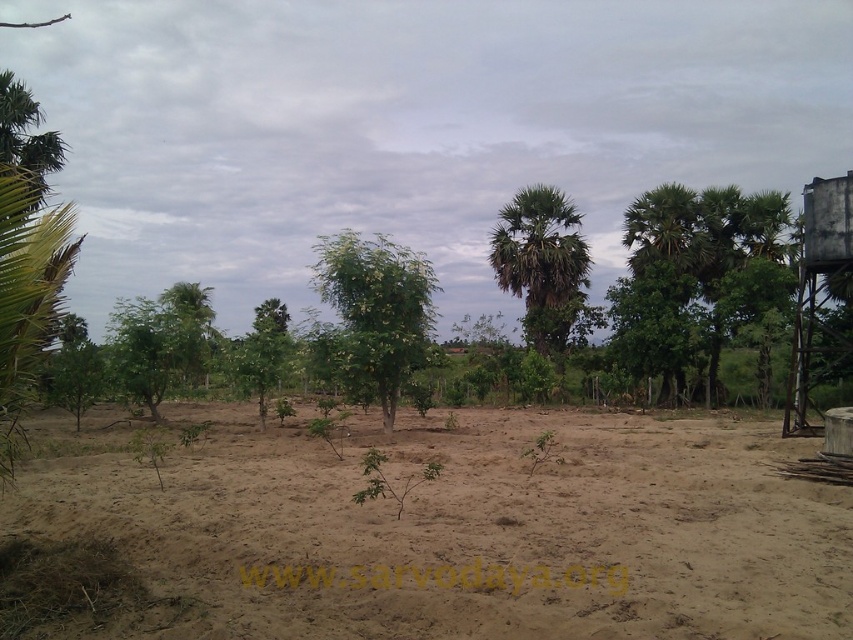
Between brown sandy soil at center and green leafy tree at center, which one is positioned higher?

green leafy tree at center is above.

Is brown sandy soil at center bigger than green leafy tree at center?

Incorrect, brown sandy soil at center is not larger than green leafy tree at center.

Is point (682, 557) farther from viewer compared to point (392, 420)?

No.

Where is `brown sandy soil at center`? brown sandy soil at center is located at coordinates (467, 525).

Which of these two, green leafy tree at center or green leafy palm tree at center, stands taller?

green leafy palm tree at center is taller.

What do you see at coordinates (378, 308) in the screenshot?
I see `green leafy tree at center` at bounding box center [378, 308].

Between point (364, 346) and point (567, 308), which one is positioned in front?

Point (364, 346) is in front.

I want to click on green leafy tree at center, so click(x=378, y=308).

Does brown sandy soil at center have a greater height compared to green leafy palm tree at center?

In fact, brown sandy soil at center may be shorter than green leafy palm tree at center.

I want to click on brown sandy soil at center, so click(467, 525).